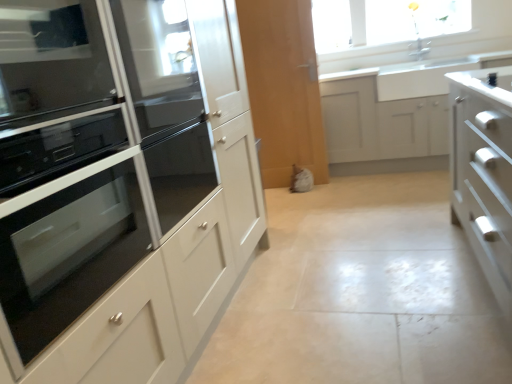
Image resolution: width=512 pixels, height=384 pixels. What do you see at coordinates (120, 185) in the screenshot? I see `matte white oven at left, the second cabinetry positioned from the back` at bounding box center [120, 185].

You are a GUI agent. You are given a task and a screenshot of the screen. Output one action in this format:
    pyautogui.click(x=<x>, y=<y>)
    Task: Click on the black glass oven at left
    
    Given the screenshot: What is the action you would take?
    pyautogui.click(x=69, y=249)

The height and width of the screenshot is (384, 512). What do you see at coordinates (51, 56) in the screenshot?
I see `black glass oven at left` at bounding box center [51, 56].

Locate an element on the screen. The image size is (512, 384). matte white oven at left, the second cabinetry positioned from the back is located at coordinates (120, 185).

Is matte white oven at left, placed as the first cabinetry when sorted from front to back, positioned with its back to white ceramic sink at upper right?

A: No, white ceramic sink at upper right is not at the back of matte white oven at left, placed as the first cabinetry when sorted from front to back.

Relative to white ceramic sink at upper right, is matte white oven at left, placed as the first cabinetry when sorted from front to back, in front or behind?

Clearly, matte white oven at left, placed as the first cabinetry when sorted from front to back, is in front of white ceramic sink at upper right.

From a real-world perspective, which is physically below, matte white oven at left, the second cabinetry positioned from the back, or white ceramic sink at upper right?

white ceramic sink at upper right.

Is matte white oven at left, the second cabinetry positioned from the back, taller than white ceramic sink at upper right?

Indeed, matte white oven at left, the second cabinetry positioned from the back, has a greater height compared to white ceramic sink at upper right.

From a real-world perspective, is white ceramic sink at upper right above or below white matte cabinet at center, positioned as the 2th cabinetry in front-to-back order?

From a real-world perspective, white ceramic sink at upper right is physically above white matte cabinet at center, positioned as the 2th cabinetry in front-to-back order.

Is white ceramic sink at upper right to the right of white matte cabinet at center, positioned as the first cabinetry in right-to-left order, from the viewer's perspective?

Yes, white ceramic sink at upper right is to the right of white matte cabinet at center, positioned as the first cabinetry in right-to-left order.

Find the location of a particular element. the 1st cabinetry below when counting from the white ceramic sink at upper right (from the image's perspective) is located at coordinates (392, 114).

Between white ceramic sink at upper right and white matte cabinet at center, positioned as the first cabinetry in right-to-left order, which one has less height?

white ceramic sink at upper right.

Is matte white oven at left, which is counted as the second cabinetry, starting from the right, behind black glass oven at left?

Yes, it is behind black glass oven at left.

Considering the positions of objects matte white oven at left, the second cabinetry positioned from the back, and black glass oven at left in the image provided, who is more to the right, matte white oven at left, the second cabinetry positioned from the back, or black glass oven at left?

Positioned to the right is matte white oven at left, the second cabinetry positioned from the back.

Choose the correct answer: Is matte white oven at left, the 1th cabinetry from the left, inside black glass oven at left or outside it?

matte white oven at left, the 1th cabinetry from the left, is spatially situated outside black glass oven at left.

Does point (428, 112) lie behind point (60, 330)?

Yes, it is behind point (60, 330).

In the scene shown: How many degrees apart are the facing directions of white matte cabinet at center, positioned as the first cabinetry in right-to-left order, and matte white oven at left, placed as the first cabinetry when sorted from front to back?

90.7 degrees.

Based on the photo, from a real-world perspective, is white matte cabinet at center, positioned as the second cabinetry in left-to-right order, over matte white oven at left, placed as the first cabinetry when sorted from front to back?

No, from a real-world perspective, white matte cabinet at center, positioned as the second cabinetry in left-to-right order, is not over matte white oven at left, placed as the first cabinetry when sorted from front to back

Can we say white matte cabinet at center, positioned as the second cabinetry in left-to-right order, lies outside matte white oven at left, the 1th cabinetry from the left?

Yes, white matte cabinet at center, positioned as the second cabinetry in left-to-right order, is located beyond the bounds of matte white oven at left, the 1th cabinetry from the left.

Image resolution: width=512 pixels, height=384 pixels. Find the location of `cabinetry below the black glass oven at left (from a real-world perspective)`. cabinetry below the black glass oven at left (from a real-world perspective) is located at coordinates (392, 114).

From the image's perspective, between white matte cabinet at center, positioned as the second cabinetry in left-to-right order, and black glass oven at left, which one is located above?

From the image's view, white matte cabinet at center, positioned as the second cabinetry in left-to-right order, is above.

Is white matte cabinet at center, acting as the 1th cabinetry starting from the back, beside black glass oven at left?

There is a gap between white matte cabinet at center, acting as the 1th cabinetry starting from the back, and black glass oven at left.

Between white matte cabinet at center, acting as the 1th cabinetry starting from the back, and black glass oven at left, which one has more height?

white matte cabinet at center, acting as the 1th cabinetry starting from the back, is taller.

Is matte white oven at left, which is counted as the second cabinetry, starting from the right, placed right next to black glass oven at left?

matte white oven at left, which is counted as the second cabinetry, starting from the right, is not next to black glass oven at left, and they're not touching.

Based on the photo, which is more to the right, matte white oven at left, the 1th cabinetry from the left, or black glass oven at left?

Positioned to the right is matte white oven at left, the 1th cabinetry from the left.

Can you confirm if matte white oven at left, which is counted as the second cabinetry, starting from the right, is smaller than black glass oven at left?

No, matte white oven at left, which is counted as the second cabinetry, starting from the right, is not smaller than black glass oven at left.

From the image's perspective, is white ceramic sink at upper right beneath black glass oven at left?

No.

Which object is thinner, white ceramic sink at upper right or black glass oven at left?

With smaller width is black glass oven at left.

Based on the photo, between white ceramic sink at upper right and black glass oven at left, which one has larger size?

black glass oven at left.

Is white ceramic sink at upper right positioned with its back to black glass oven at left?

white ceramic sink at upper right is not turned away from black glass oven at left.

Locate an element on the screen. The image size is (512, 384). sink to the right of matte white oven at left, the 1th cabinetry from the left is located at coordinates (421, 77).

This screenshot has width=512, height=384. What are the coordinates of `cabinetry located underneath the white ceramic sink at upper right (from a real-world perspective)` in the screenshot? It's located at (392, 114).

Estimate the real-world distances between objects in this image. Which object is further from matte white oven at left, the 1th cabinetry from the left, black glass oven at left or black glass oven at left?

black glass oven at left is further to matte white oven at left, the 1th cabinetry from the left.

Which object lies further to the anchor point matte white oven at left, the 1th cabinetry from the left, black glass oven at left or white ceramic sink at upper right?

white ceramic sink at upper right is positioned further to the anchor matte white oven at left, the 1th cabinetry from the left.

Estimate the real-world distances between objects in this image. Which object is further from white matte cabinet at center, positioned as the second cabinetry in left-to-right order, black glass oven at left or matte white oven at left, which is counted as the second cabinetry, starting from the right?

Based on the image, black glass oven at left appears to be further to white matte cabinet at center, positioned as the second cabinetry in left-to-right order.

Estimate the real-world distances between objects in this image. Which object is closer to white ceramic sink at upper right, matte white oven at left, the 1th cabinetry from the left, or black glass oven at left?

Based on the image, matte white oven at left, the 1th cabinetry from the left, appears to be nearer to white ceramic sink at upper right.

Considering their positions, is black glass oven at left positioned closer to white matte cabinet at center, positioned as the first cabinetry in right-to-left order, than white ceramic sink at upper right?

white ceramic sink at upper right is closer to white matte cabinet at center, positioned as the first cabinetry in right-to-left order.

When comparing their distances from matte white oven at left, the 1th cabinetry from the left, does black glass oven at left or white matte cabinet at center, positioned as the first cabinetry in right-to-left order, seem closer?

The object closer to matte white oven at left, the 1th cabinetry from the left, is black glass oven at left.

Estimate the real-world distances between objects in this image. Which object is further from matte white oven at left, placed as the first cabinetry when sorted from front to back, black glass oven at left or black glass oven at left?

black glass oven at left is positioned further to the anchor matte white oven at left, placed as the first cabinetry when sorted from front to back.

Considering their positions, is black glass oven at left positioned closer to black glass oven at left than matte white oven at left, the 1th cabinetry from the left?

matte white oven at left, the 1th cabinetry from the left.

Where is `cabinetry between black glass oven at left and white matte cabinet at center, acting as the 1th cabinetry starting from the back, from front to back`? cabinetry between black glass oven at left and white matte cabinet at center, acting as the 1th cabinetry starting from the back, from front to back is located at coordinates (120, 185).

Identify the location of home appliance positioned between black glass oven at left and matte white oven at left, placed as the first cabinetry when sorted from front to back, from near to far. The height and width of the screenshot is (384, 512). (51, 56).

Identify the location of home appliance between black glass oven at left and white ceramic sink at upper right from front to back. pos(51,56).

What are the coordinates of `home appliance positioned between black glass oven at left and white matte cabinet at center, positioned as the 2th cabinetry in front-to-back order, from near to far` in the screenshot? It's located at (51, 56).